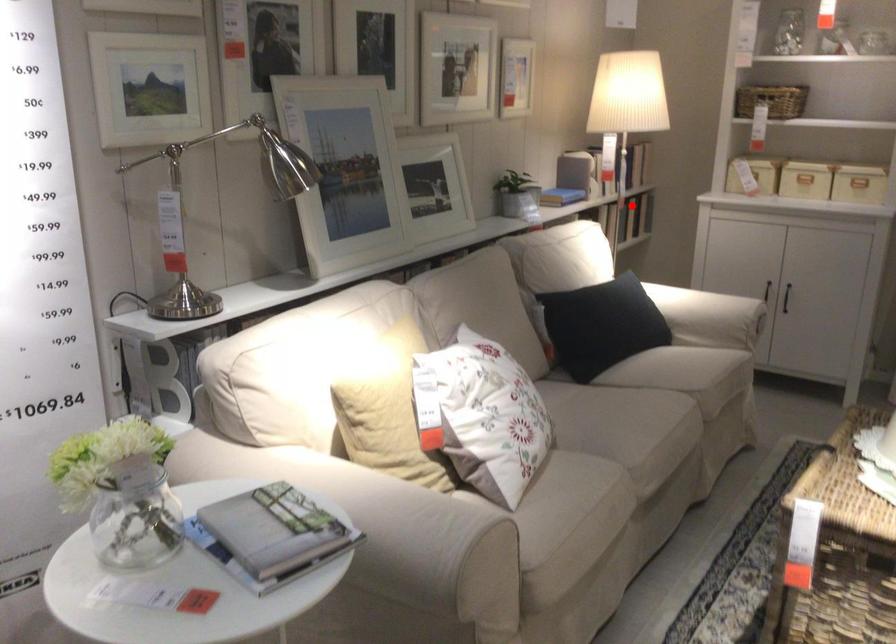
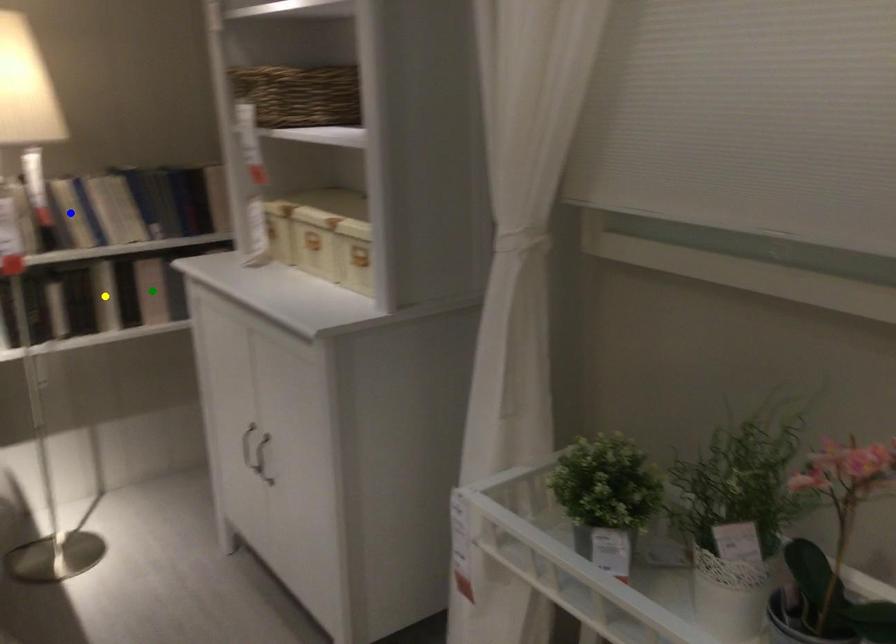
Question: I am providing you with two images of the same scene from different viewpoints. A red point is marked on the first image. You are given multiple points on the second image. In image 2, which mark is for the same physical point as the one in image 1?

Choices:
 (A) blue point
 (B) green point
 (C) yellow point

Answer: (B)